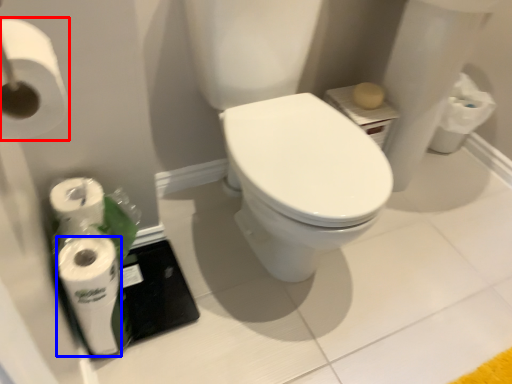
Question: Which object appears farthest to the camera in this image, toilet paper (highlighted by a red box) or toilet paper (highlighted by a blue box)?

Choices:
 (A) toilet paper
 (B) toilet paper

Answer: (B)